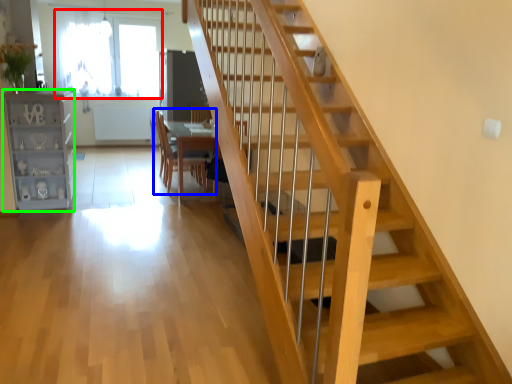
Question: Which object is the closest to the window (highlighted by a red box)? Choose among these: chair (highlighted by a blue box) or bookshelf (highlighted by a green box).

Choices:
 (A) chair
 (B) bookshelf

Answer: (A)